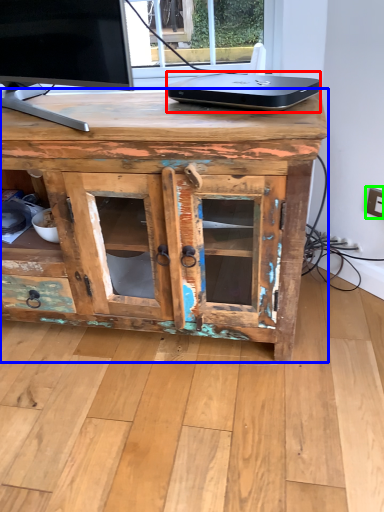
Question: Which object is positioned farthest from laptop (highlighted by a red box)? Select from desk (highlighted by a blue box) and electric outlet (highlighted by a green box).

Choices:
 (A) desk
 (B) electric outlet

Answer: (B)